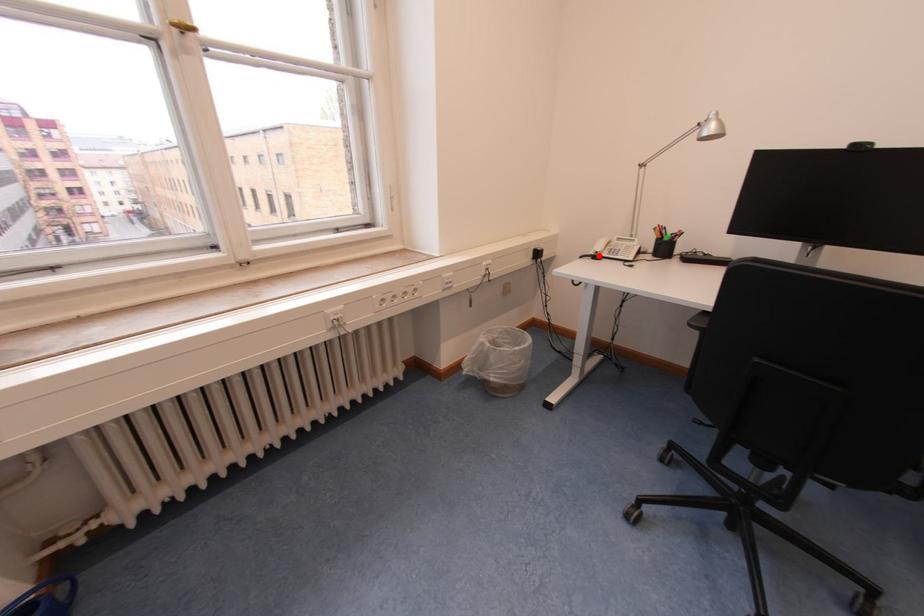
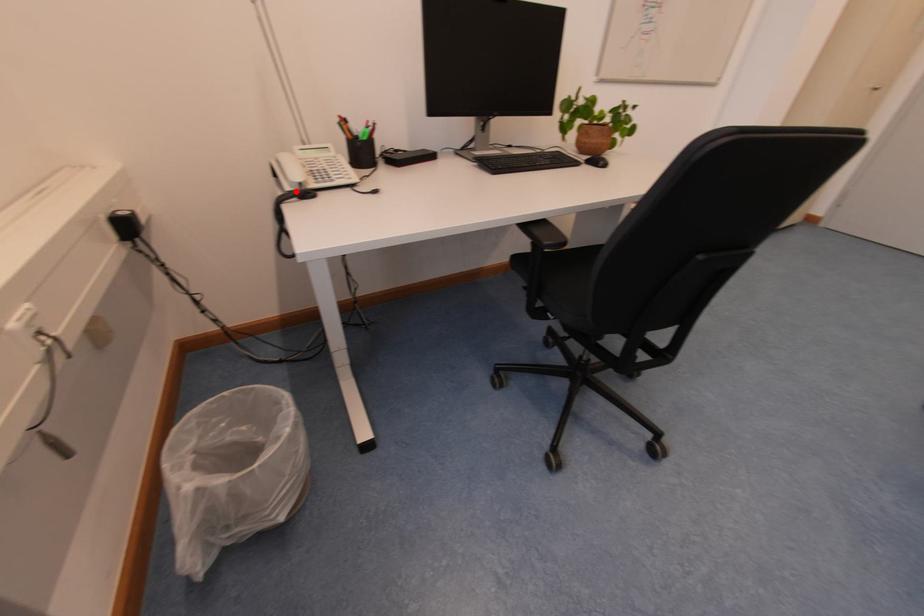
I am providing you with two images of the same scene from different viewpoints. A red point is marked on the first image and another point is marked on the second image. Is the red point in image1 aligned with the point shown in image2?

Yes